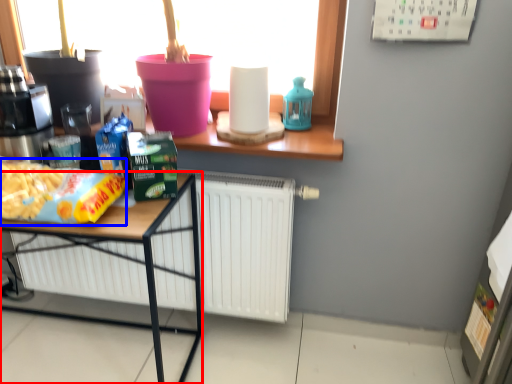
Question: Which of the following is the closest to the observer, desk (highlighted by a red box) or food (highlighted by a blue box)?

Choices:
 (A) desk
 (B) food

Answer: (B)